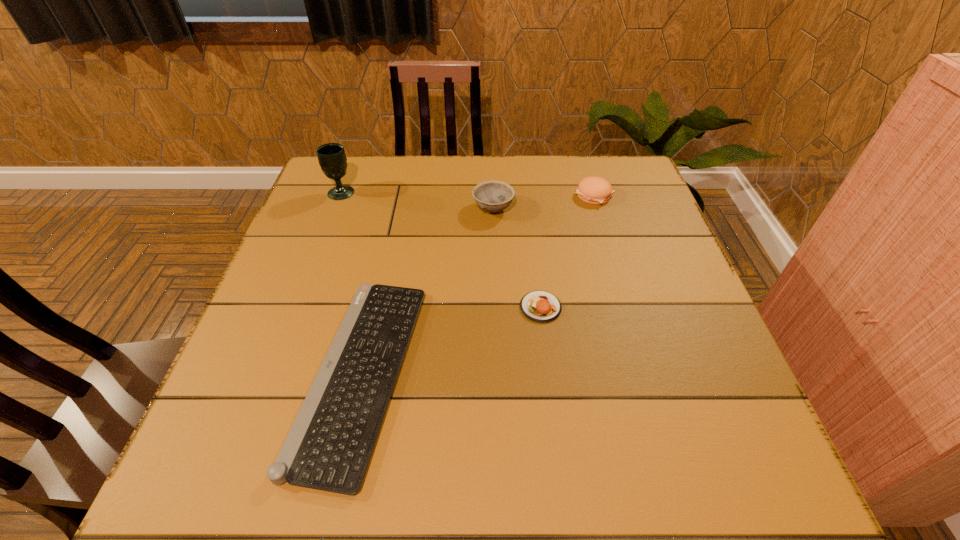
You are a GUI agent. You are given a task and a screenshot of the screen. Output one action in this format:
    pyautogui.click(x=<x>, y=<y>)
    Task: Click on the vacant space that satisfies the following two spatial constraints: 1. on the back side of the third shortest object; 2. on the right side of the computer keyboard
    The image size is (960, 540).
    Given the screenshot: What is the action you would take?
    pyautogui.click(x=399, y=195)

The height and width of the screenshot is (540, 960). Find the location of `vacant position in the image that satisfies the following two spatial constraints: 1. on the back side of the taller patty (food); 2. on the right side of the shorter patty (food)`. vacant position in the image that satisfies the following two spatial constraints: 1. on the back side of the taller patty (food); 2. on the right side of the shorter patty (food) is located at coordinates (527, 195).

What are the coordinates of `free region that satisfies the following two spatial constraints: 1. on the front side of the nearer patty (food); 2. on the left side of the leftmost object` in the screenshot? It's located at (299, 307).